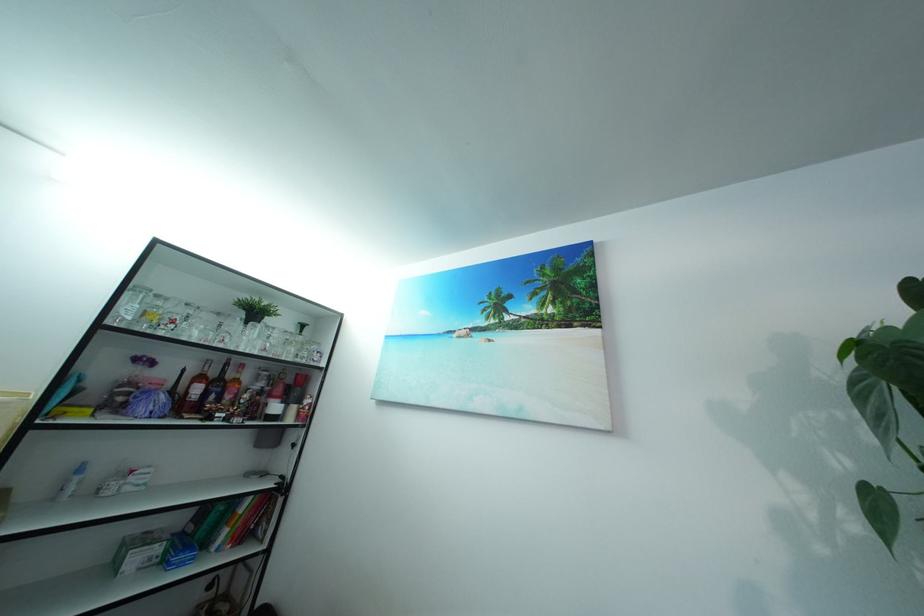
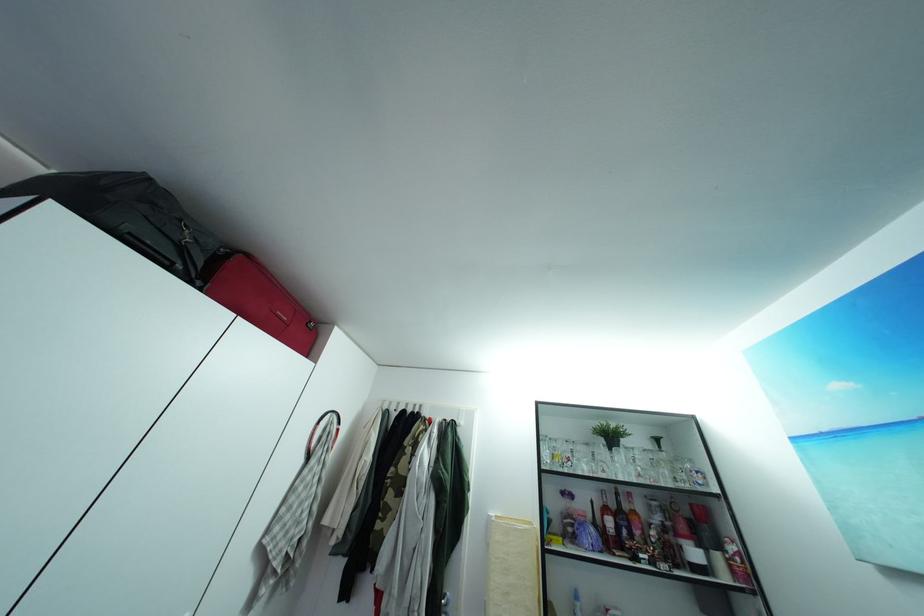
First-person continuous shooting, in which direction is the camera rotating?

The rotation direction of the camera is left-up.